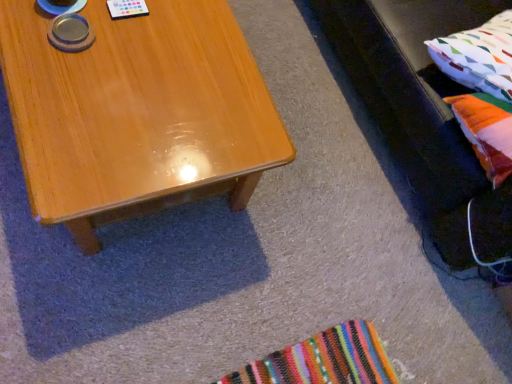
Question: Considering the positions of velvet black couch at right and shiny wood coffee table at center in the image, is velvet black couch at right wider or thinner than shiny wood coffee table at center?

Choices:
 (A) wide
 (B) thin

Answer: (A)

Question: Is velvet black couch at right to the left or to the right of shiny wood coffee table at center in the image?

Choices:
 (A) right
 (B) left

Answer: (A)

Question: Which of these objects is positioned farthest from the velvet black couch at right?

Choices:
 (A) multicolored fabric pillow at right, which appears as the first pillow when viewed from the top
 (B) multicolored fabric pillow at right, the first pillow when ordered from bottom to top
 (C) shiny wood coffee table at center

Answer: (C)

Question: Which object is the farthest from the multicolored fabric pillow at right, placed as the 2th pillow when sorted from top to bottom?

Choices:
 (A) velvet black couch at right
 (B) shiny wood coffee table at center
 (C) multicolored fabric pillow at right, which is the second pillow in bottom-to-top order

Answer: (B)